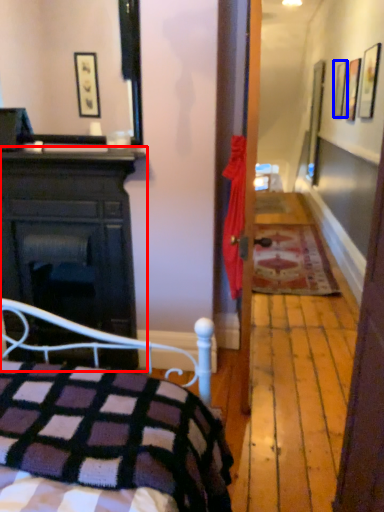
Question: Which point is further to the camera, cabinetry (highlighted by a red box) or picture frame (highlighted by a blue box)?

Choices:
 (A) cabinetry
 (B) picture frame

Answer: (B)